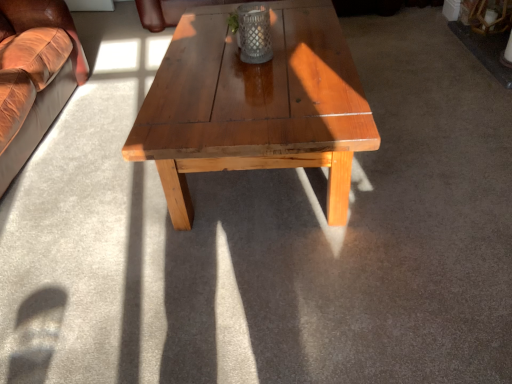
Locate an element on the screen. The height and width of the screenshot is (384, 512). leather couch at left is located at coordinates (34, 75).

This screenshot has height=384, width=512. What do you see at coordinates (34, 75) in the screenshot?
I see `leather couch at left` at bounding box center [34, 75].

Find the location of a particular element. This screenshot has width=512, height=384. leather couch at left is located at coordinates (34, 75).